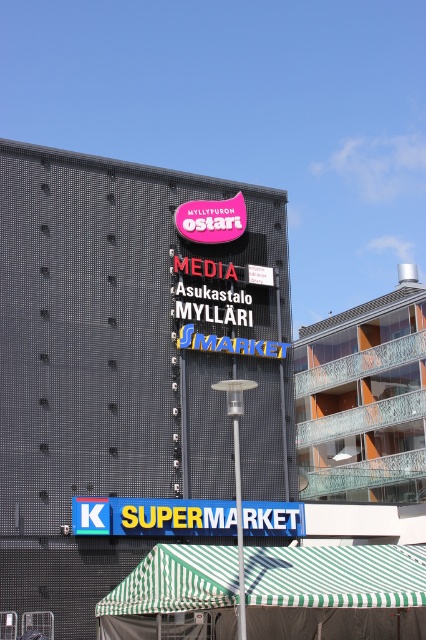
Is green striped canopy at lower center smaller than orange glass balcony at upper right?

Yes, green striped canopy at lower center is smaller than orange glass balcony at upper right.

Measure the distance between green striped canopy at lower center and camera.

green striped canopy at lower center is 25.26 meters away from camera.

This screenshot has height=640, width=426. Identify the location of green striped canopy at lower center. (336, 592).

Is green striped canopy at lower center taller than blue plastic sign at bottom?

Correct, green striped canopy at lower center is much taller as blue plastic sign at bottom.

Does green striped canopy at lower center come in front of blue plastic sign at bottom?

Yes, green striped canopy at lower center is closer to the viewer.

Does point (296, 614) lie behind point (299, 522)?

That is False.

This screenshot has height=640, width=426. Find the location of `green striped canopy at lower center`. green striped canopy at lower center is located at coordinates (336, 592).

Can you confirm if orange glass balcony at upper right is taller than pink fabric sign at upper center?

Yes, orange glass balcony at upper right is taller than pink fabric sign at upper center.

Does point (400, 426) lie in front of point (206, 212)?

That is False.

Where is `orange glass balcony at upper right`? Image resolution: width=426 pixels, height=640 pixels. orange glass balcony at upper right is located at coordinates (363, 400).